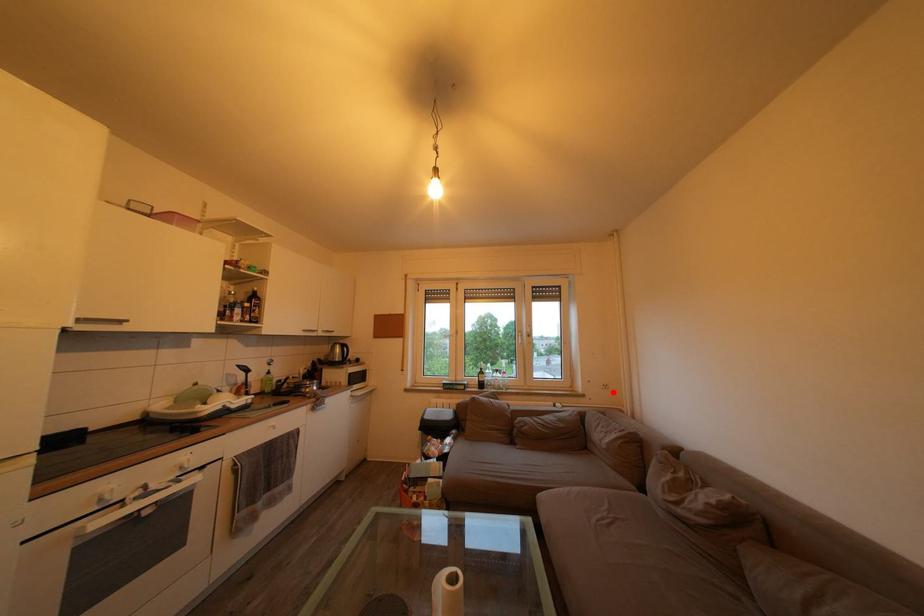
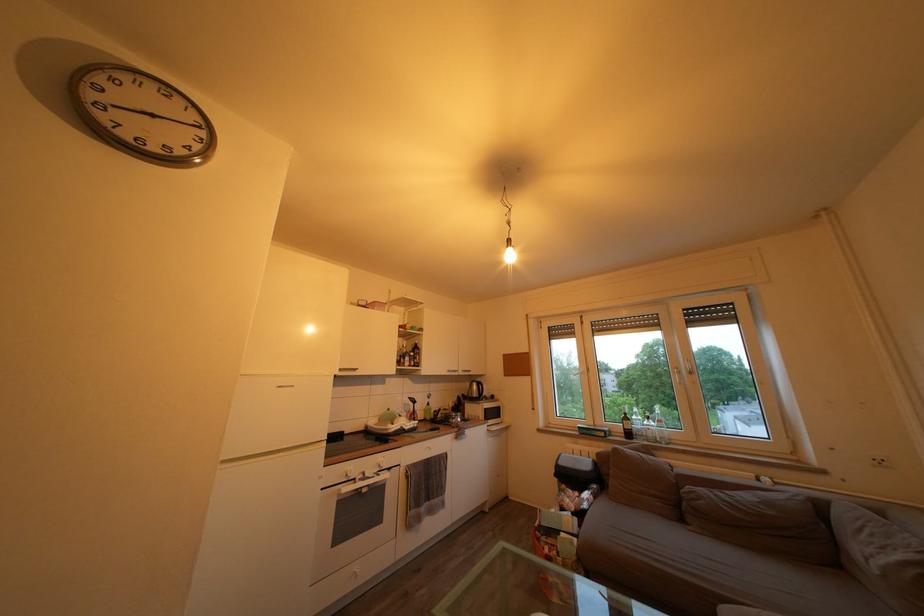
Question: I am providing you with two images of the same scene from different viewpoints. Given a red point in image1, look at the same physical point in image2. Is it:

Choices:
 (A) Closer to the viewpoint
 (B) Farther from the viewpoint

Answer: (A)